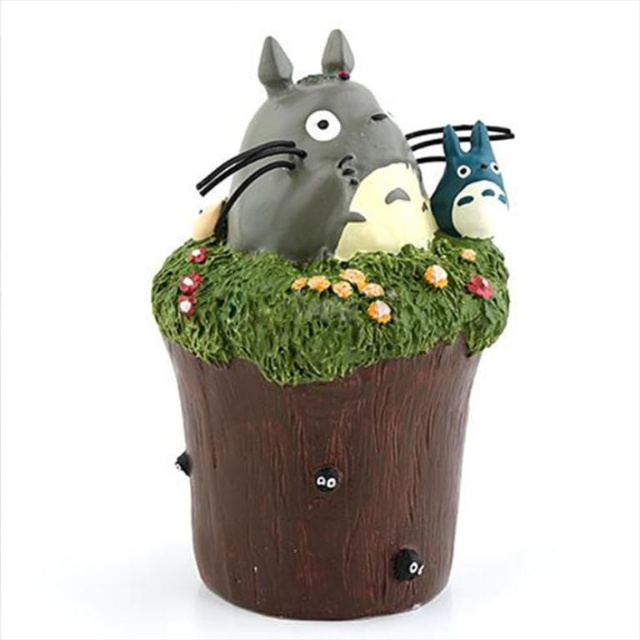
You are a tiny insect standing on the green grass at center. You want to crawl to the blue matte totoro at center. Which direction should you move to get closer?

The green grass at center is closer to the viewer than the blue matte totoro at center, so to reach the blue matte totoro at center, you should move backward away from the viewer.

You are a small toy that is 5 cm in height. You want to place yourself on the matte brown tree stump at center or the blue matte totoro at center. Which one can you fit on without falling off?

The matte brown tree stump at center is bigger than the blue matte totoro at center, so the toy can fit on the matte brown tree stump at center without falling off.